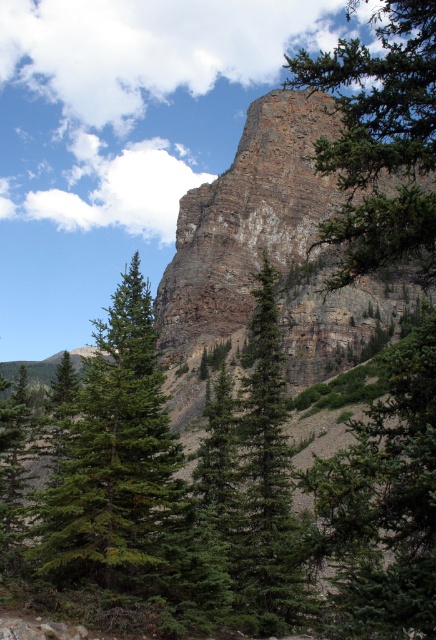
You are a hiker standing at the base of the mountain. You notice two points marked on the cliff face. The first point is at coordinates point (162,508) and the second is at point (249,464). Which point is higher up on the cliff face?

Point (249,464) is higher up on the cliff face than point (162,508) because it is farther from the camera, indicating it is positioned higher in the scene.

You are a hiker trying to navigate through the mountainous area. You see a rusty brown rock at upper center and a green textured pine tree at upper right. Which object is located to the left of the other?

The rusty brown rock at upper center is positioned on the left side of green textured pine tree at upper right.